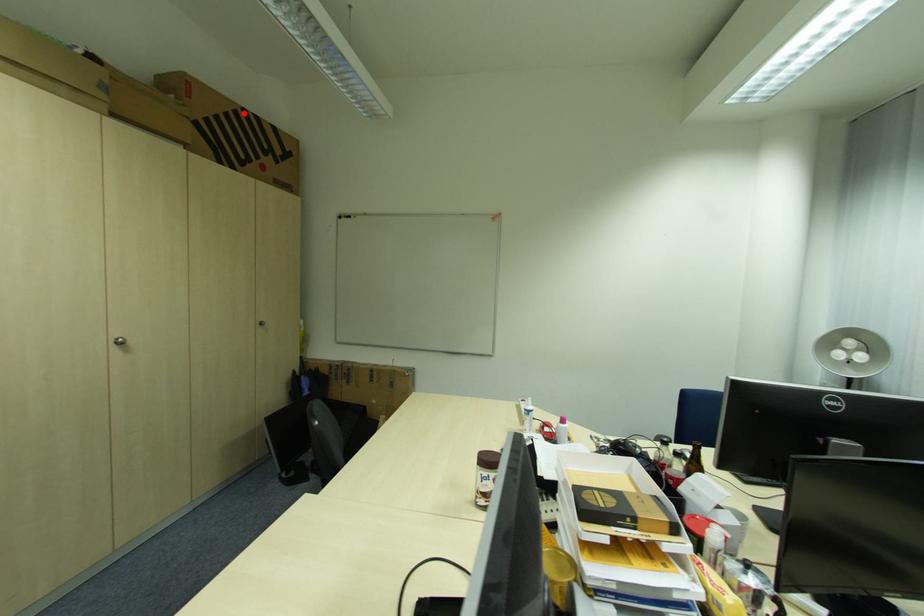
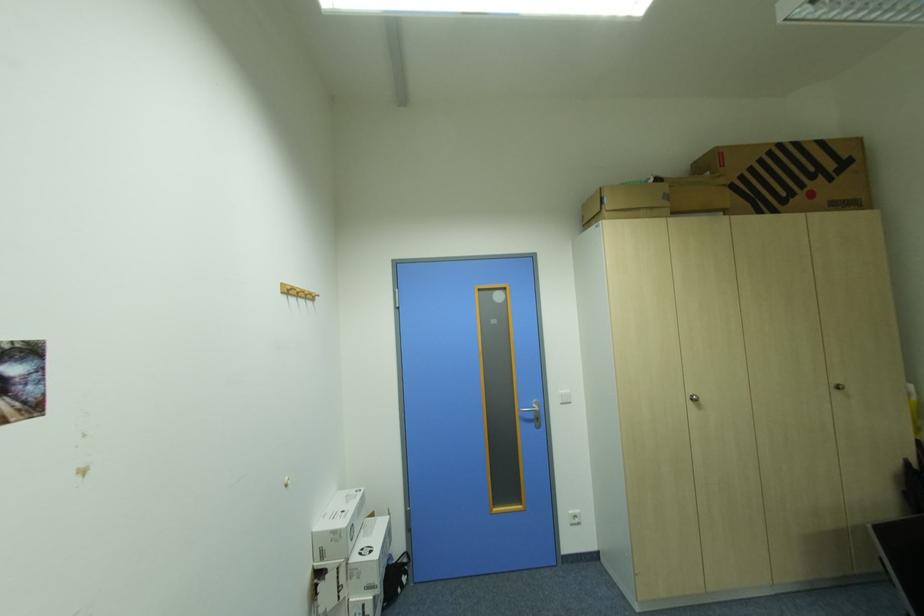
Where in the second image is the point corresponding to the highlighted location from the first image?

(777, 153)